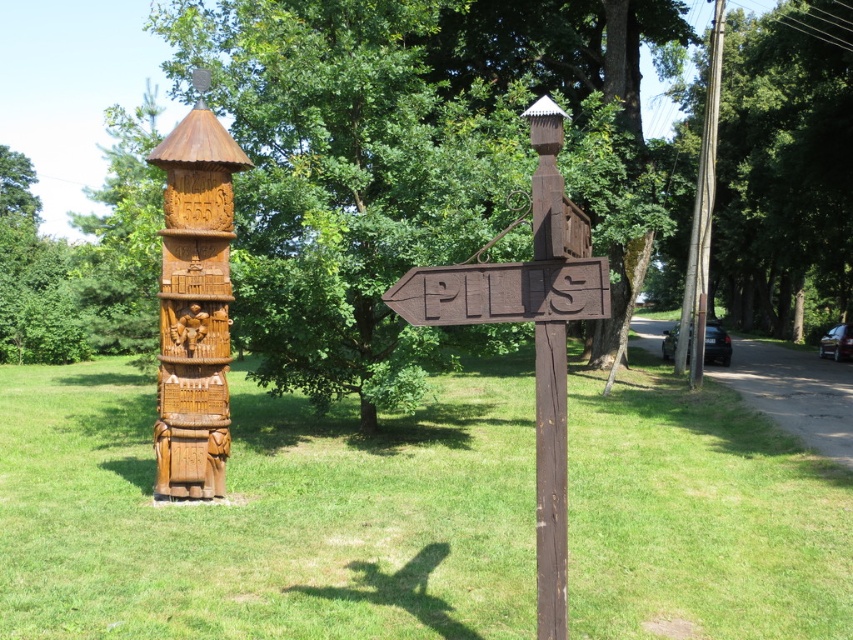
Is green grass at left further to the viewer compared to carved wood totem pole at center?

No, it is not.

Between green grass at left and carved wood totem pole at center, which one appears on the right side from the viewer's perspective?

green grass at left is more to the right.

This screenshot has height=640, width=853. What do you see at coordinates (267, 515) in the screenshot?
I see `green grass at left` at bounding box center [267, 515].

Find the location of a particular element. This screenshot has width=853, height=640. green grass at left is located at coordinates (267, 515).

Who is positioned more to the right, brown wooden signpost at center or brown wooden sign at center-left?

Positioned to the right is brown wooden signpost at center.

From the picture: Between brown wooden signpost at center and brown wooden sign at center-left, which one is positioned lower?

brown wooden signpost at center

Is point (418, 300) positioned in front of point (535, 316)?

No, it is not.

The width and height of the screenshot is (853, 640). I want to click on brown wooden signpost at center, so click(534, 333).

The height and width of the screenshot is (640, 853). In order to click on brown wooden signpost at center in this screenshot , I will do `click(534, 333)`.

Measure the distance between brown wooden signpost at center and carved wood totem pole at center.

The distance of brown wooden signpost at center from carved wood totem pole at center is 4.65 meters.

Who is more distant from viewer, [445,273] or [202,456]?

The point [202,456] is more distant.

At what (x,y) coordinates should I click in order to perform the action: click on brown wooden signpost at center. Please return your answer as a coordinate pair (x, y). This screenshot has width=853, height=640. Looking at the image, I should click on coord(534,333).